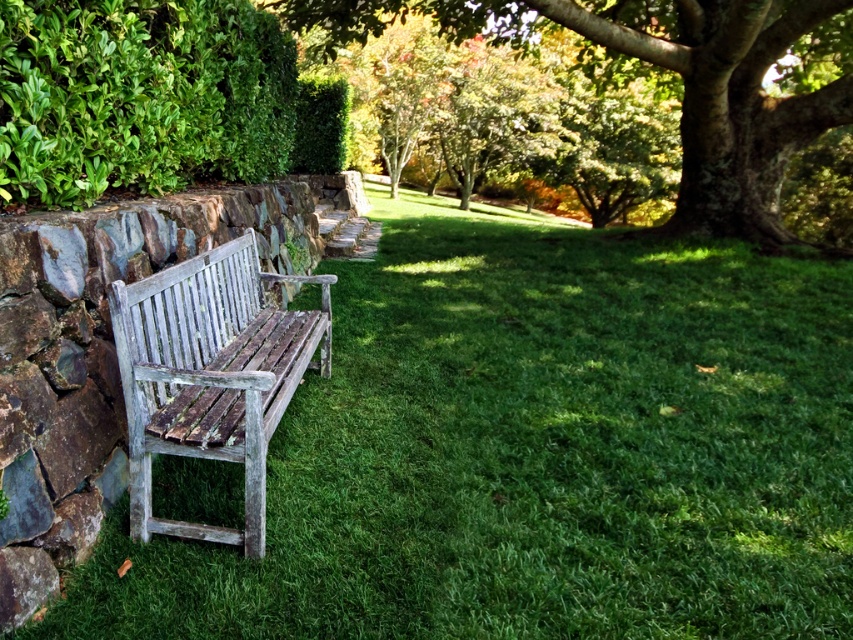
Who is lower down, green leafy bush at upper left or green leafy tree at center?

green leafy bush at upper left

Between point (276, 131) and point (650, 4), which one is positioned in front?

Point (276, 131) is more forward.

Between point (221, 61) and point (396, 3), which one is positioned in front?

Point (221, 61) is more forward.

The height and width of the screenshot is (640, 853). I want to click on green leafy bush at upper left, so click(138, 97).

Is green leafy tree at center positioned behind weathered wood bench at left?

Yes.

Who is positioned more to the left, green leafy tree at center or weathered wood bench at left?

From the viewer's perspective, weathered wood bench at left appears more on the left side.

Between point (791, 106) and point (148, 358), which one is positioned in front?

Point (148, 358) is in front.

Locate an element on the screen. The width and height of the screenshot is (853, 640). green leafy tree at center is located at coordinates (680, 76).

Is green leafy bush at upper left taller than weathered wood bench at left?

Yes, green leafy bush at upper left is taller than weathered wood bench at left.

Based on the photo, does green leafy bush at upper left lie in front of weathered wood bench at left?

No, green leafy bush at upper left is behind weathered wood bench at left.

The image size is (853, 640). I want to click on green leafy bush at upper left, so click(138, 97).